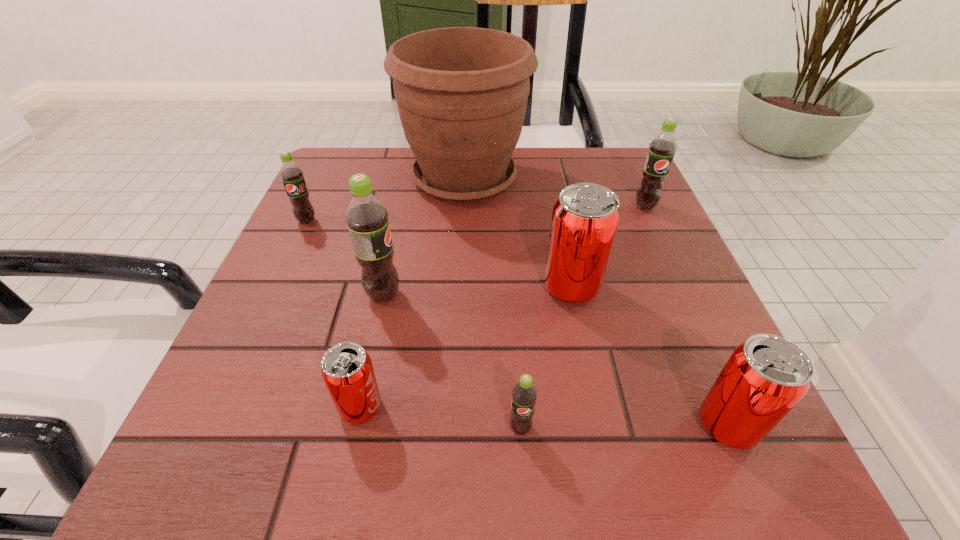
The height and width of the screenshot is (540, 960). What are the coordinates of `the tallest object` in the screenshot? It's located at (461, 92).

Image resolution: width=960 pixels, height=540 pixels. What are the coordinates of `the second tallest object` in the screenshot? It's located at (366, 216).

You are a GUI agent. You are given a task and a screenshot of the screen. Output one action in this format:
    pyautogui.click(x=<x>, y=<y>)
    Task: Click on the tallest soda
    Image resolution: width=960 pixels, height=540 pixels.
    Given the screenshot: What is the action you would take?
    pyautogui.click(x=366, y=216)

Where is `the biggest red soda can`? Image resolution: width=960 pixels, height=540 pixels. the biggest red soda can is located at coordinates (585, 218).

You are a GUI agent. You are given a task and a screenshot of the screen. Output one action in this format:
    pyautogui.click(x=<x>, y=<y>)
    Task: Click on the second red soda can from right to left
    This screenshot has width=960, height=540.
    Given the screenshot: What is the action you would take?
    pyautogui.click(x=585, y=218)

At what (x,y) coordinates should I click in order to perform the action: click on the farthest soda. Please return your answer as a coordinate pair (x, y). The image size is (960, 540). Looking at the image, I should click on (662, 148).

Identify the location of the rightmost green soda. This screenshot has width=960, height=540. (662, 148).

You are a GUI agent. You are given a task and a screenshot of the screen. Output one action in this format:
    pyautogui.click(x=<x>, y=<y>)
    Task: Click on the second farthest soda
    The image size is (960, 540).
    Given the screenshot: What is the action you would take?
    pyautogui.click(x=291, y=174)

At what (x,y) coordinates should I click in order to perform the action: click on the leftmost soda. Please return your answer as a coordinate pair (x, y). This screenshot has height=540, width=960. Looking at the image, I should click on (291, 174).

Locate an element on the screen. the second biggest red soda can is located at coordinates (765, 377).